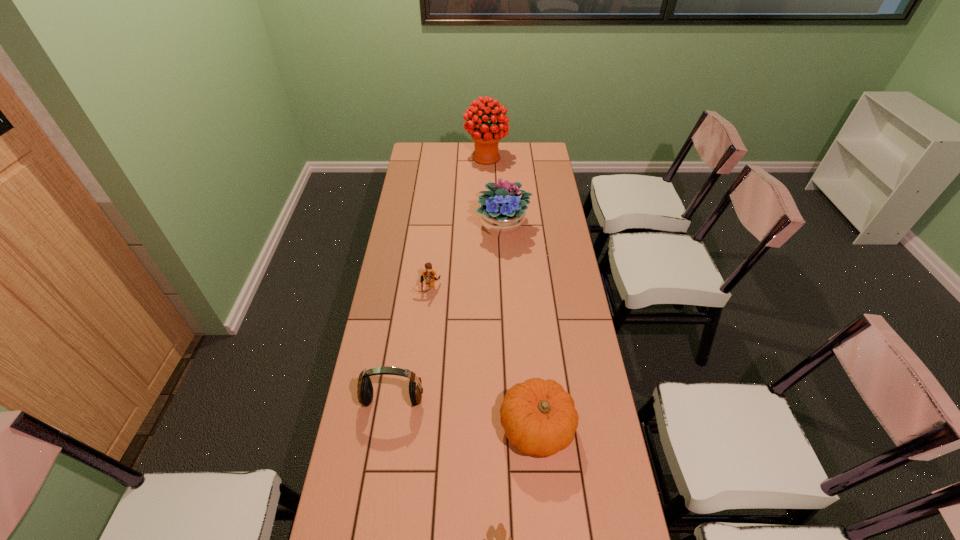
In order to click on vacant space at the far left corner in this screenshot , I will do `click(434, 150)`.

This screenshot has width=960, height=540. Identify the location of free spot between the pumpkin and the fifth shortest object. (520, 327).

Where is `vacant area that lies between the pumpkin and the farthest object`? vacant area that lies between the pumpkin and the farthest object is located at coordinates (512, 292).

Find the location of a particular element. The height and width of the screenshot is (540, 960). vacant region between the farthest object and the pumpkin is located at coordinates (512, 292).

Locate an element on the screen. vacant space that's between the third farthest object and the pumpkin is located at coordinates [482, 358].

Identify the location of empty space between the pumpkin and the third farthest object. (482, 358).

Identify the location of object that stands as the second closest to the headset. (429, 274).

Identify which object is the fourth closest to the bird. Please provide its 2D coordinates. Your answer should be formatted as a tuple, i.e. [(x, y)], where the tuple contains the x and y coordinates of a point satisfying the conditions above.

[(501, 211)]

Identify the location of vacant region that satisfies the following two spatial constraints: 1. holding a crossbow in the hands of the pumpkin; 2. on the left side of the fourth nearest object. This screenshot has width=960, height=540. (412, 428).